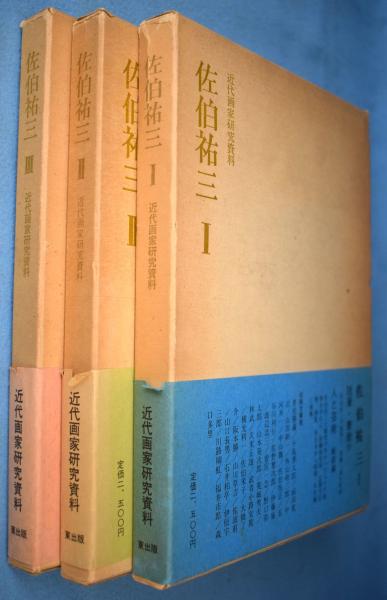
Image resolution: width=387 pixels, height=600 pixels. In order to click on shadow from books in this screenshot , I will do `click(318, 547)`, `click(25, 586)`, `click(84, 586)`.